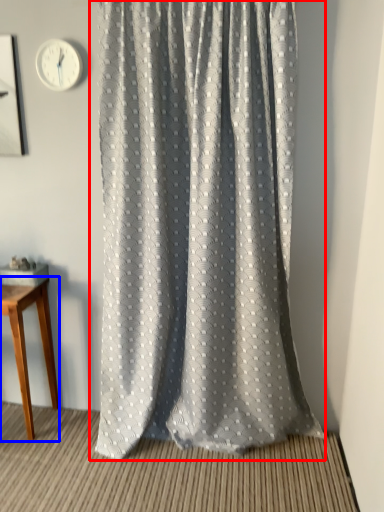
Question: Which of the following is the closest to the observer, curtain (highlighted by a red box) or table (highlighted by a blue box)?

Choices:
 (A) curtain
 (B) table

Answer: (A)